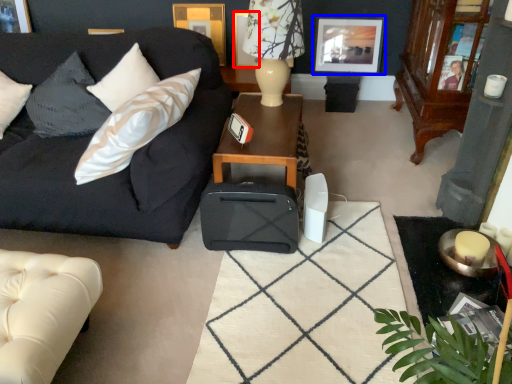
Question: Among these objects, which one is farthest to the camera, picture frame (highlighted by a red box) or picture frame (highlighted by a blue box)?

Choices:
 (A) picture frame
 (B) picture frame

Answer: (A)